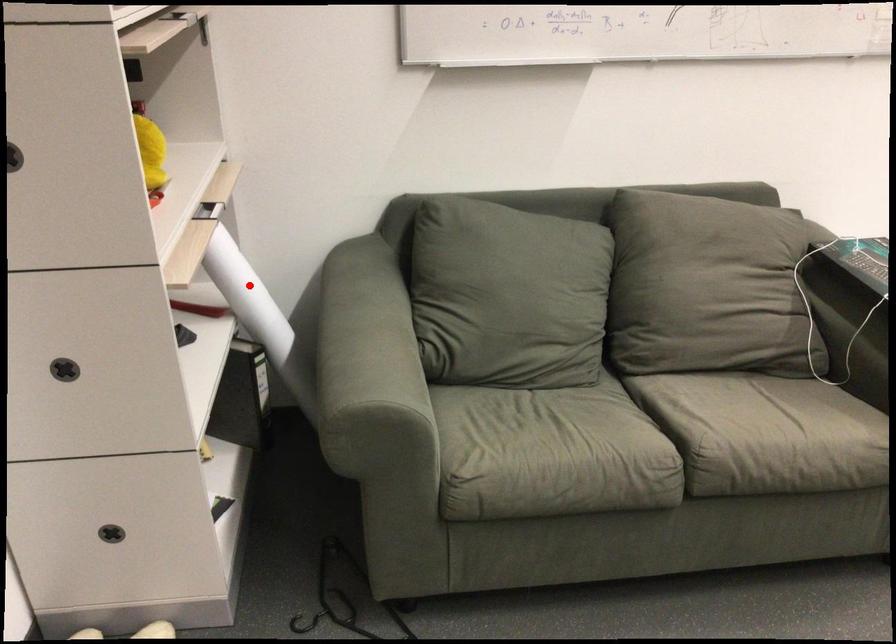
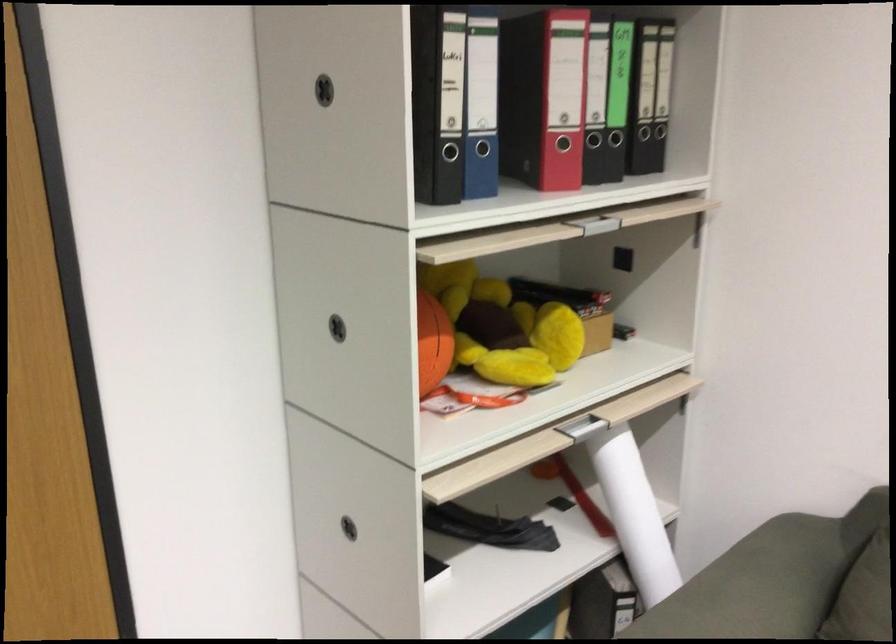
Question: A red point is marked in image1. In image2, is the corresponding 3D point closer to the camera or farther? Reply with the corresponding letter.

Choices:
 (A) The corresponding 3D point is closer.
 (B) The corresponding 3D point is farther.

Answer: (A)